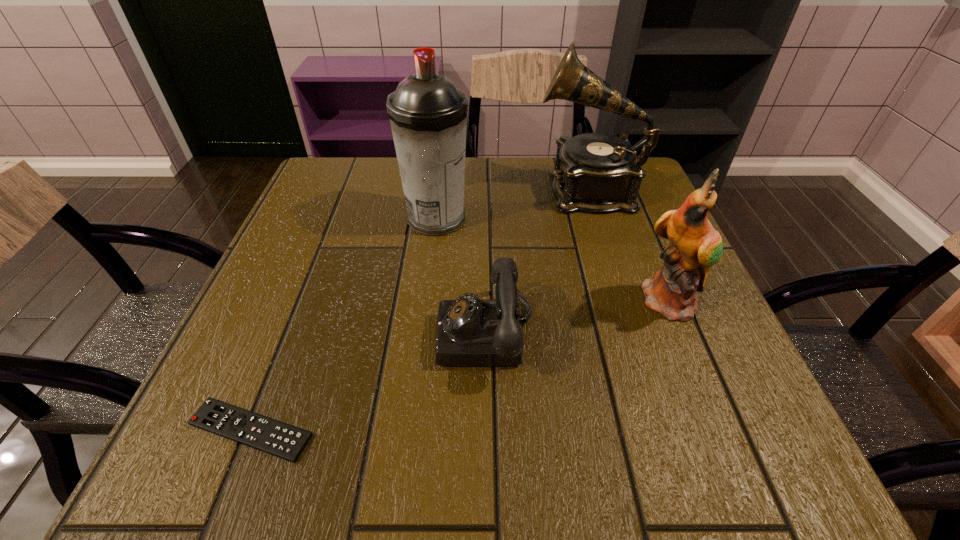
The width and height of the screenshot is (960, 540). I want to click on aerosol can, so click(x=428, y=114).

Find the location of a particular element. The width and height of the screenshot is (960, 540). phonograph record is located at coordinates (594, 172).

At what (x,y) coordinates should I click in order to perform the action: click on parrot. Please return your answer as a coordinate pair (x, y). The width and height of the screenshot is (960, 540). Looking at the image, I should click on (695, 246).

Locate an element on the screen. The image size is (960, 540). the second shortest object is located at coordinates (470, 331).

Locate an element on the screen. The height and width of the screenshot is (540, 960). the nearest object is located at coordinates point(285,441).

Where is `remote control`? The height and width of the screenshot is (540, 960). remote control is located at coordinates (285, 441).

You are a GUI agent. You are given a task and a screenshot of the screen. Output one action in this format:
    pyautogui.click(x=<x>, y=<y>)
    Task: Click on the vacant space located 0.140m on the right of the aerosol can
    
    Given the screenshot: What is the action you would take?
    pyautogui.click(x=533, y=219)

This screenshot has width=960, height=540. I want to click on vacant space located 0.340m on the horn of the phonograph record, so click(396, 190).

Locate an element on the screen. vacant space located 0.260m on the horn of the phonograph record is located at coordinates (429, 190).

You are a GUI agent. You are given a task and a screenshot of the screen. Output one action in this format:
    pyautogui.click(x=<x>, y=<y>)
    Task: Click on the free region located on the horn of the phonograph record
    
    Given the screenshot: What is the action you would take?
    pyautogui.click(x=404, y=190)